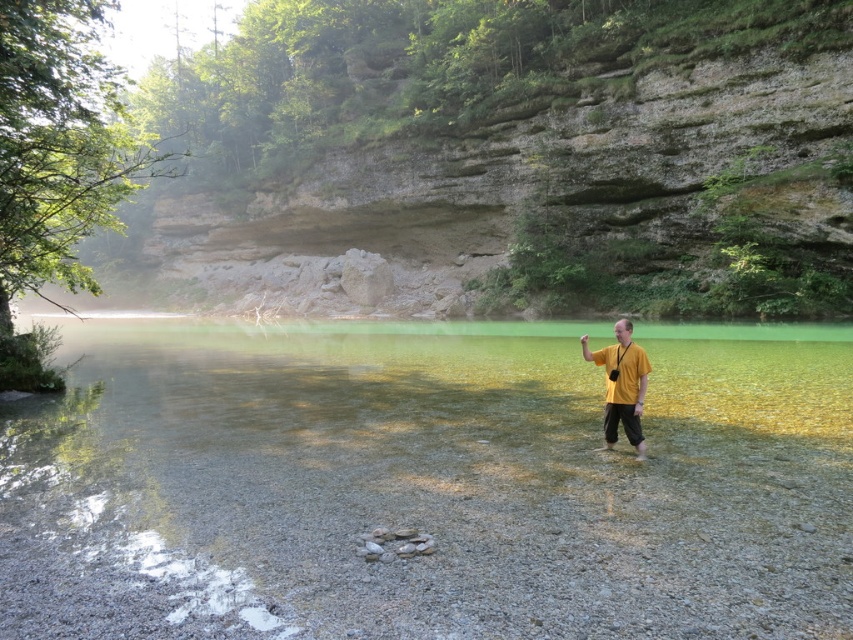
You are a photographer trying to capture a wide shot of the clear glass lake at center and the yellow matte shirt at right. Given that the lake is larger than the shirt, which object should you focus on first to ensure both are in frame?

The clear glass lake at center is larger in size than the yellow matte shirt at right, so you should focus on the clear glass lake at center first to ensure both fit within the frame.

You are a photographer trying to capture the reflection of the clear glass lake at center in your shot. Since the yellow matte shirt at right might block the reflection, will the shirt be taller than the lake in the scene?

The clear glass lake at center has a greater height compared to the yellow matte shirt at right, so the shirt will not block the reflection as it is shorter than the lake.